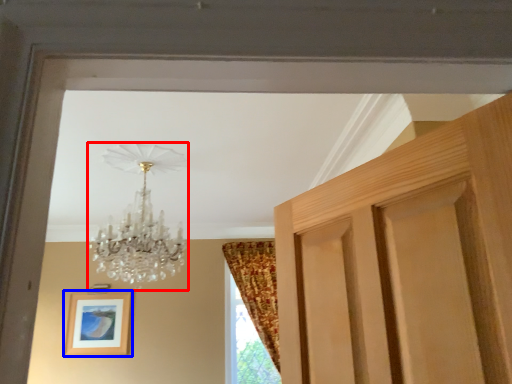
Question: Which of the following is the farthest to the observer, lamp (highlighted by a red box) or picture frame (highlighted by a blue box)?

Choices:
 (A) lamp
 (B) picture frame

Answer: (B)